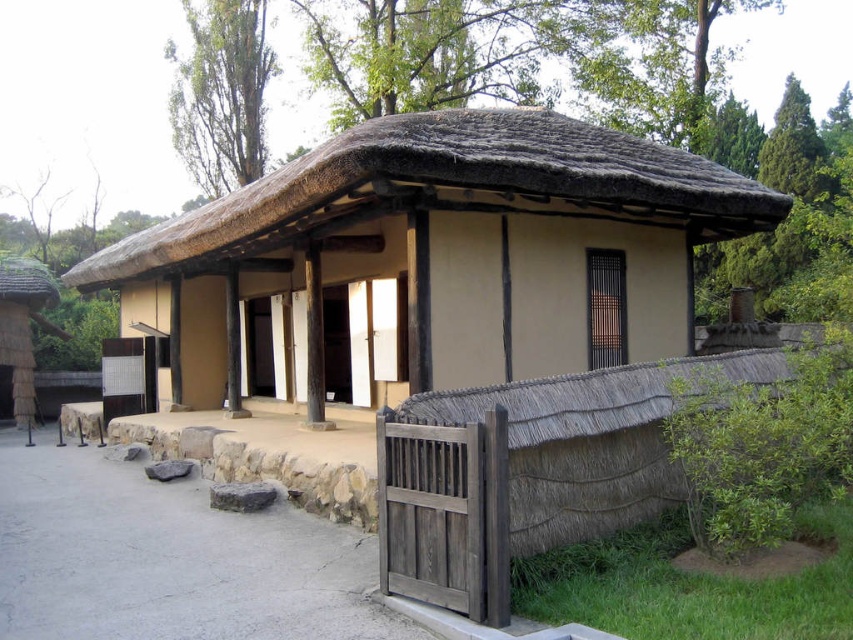
At what (x,y) coordinates should I click in order to perform the action: click on beige thatched roof hut at center. Please return your answer as a coordinate pair (x, y). Image resolution: width=853 pixels, height=640 pixels. Looking at the image, I should click on (428, 262).

Find the location of a particular element. beige thatched roof hut at center is located at coordinates (428, 262).